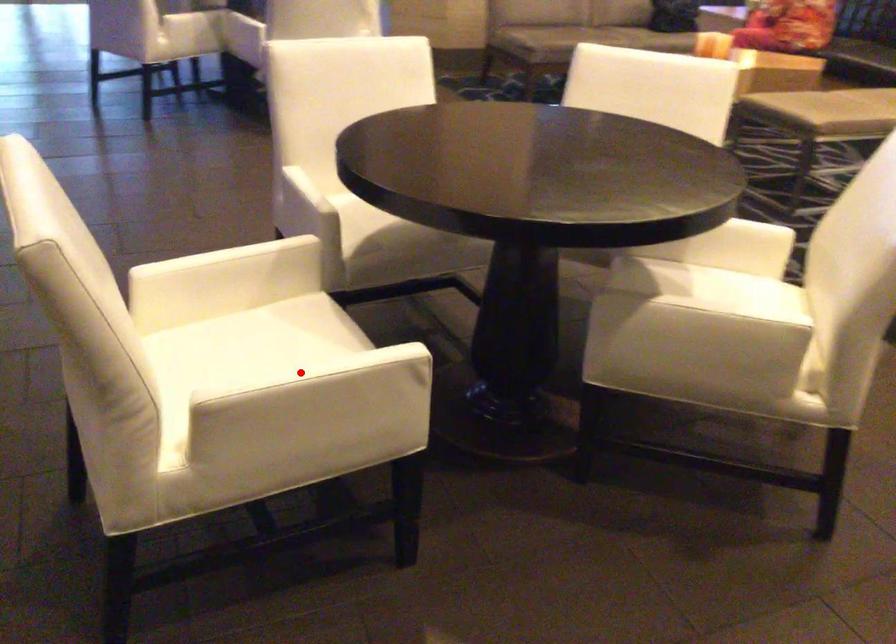
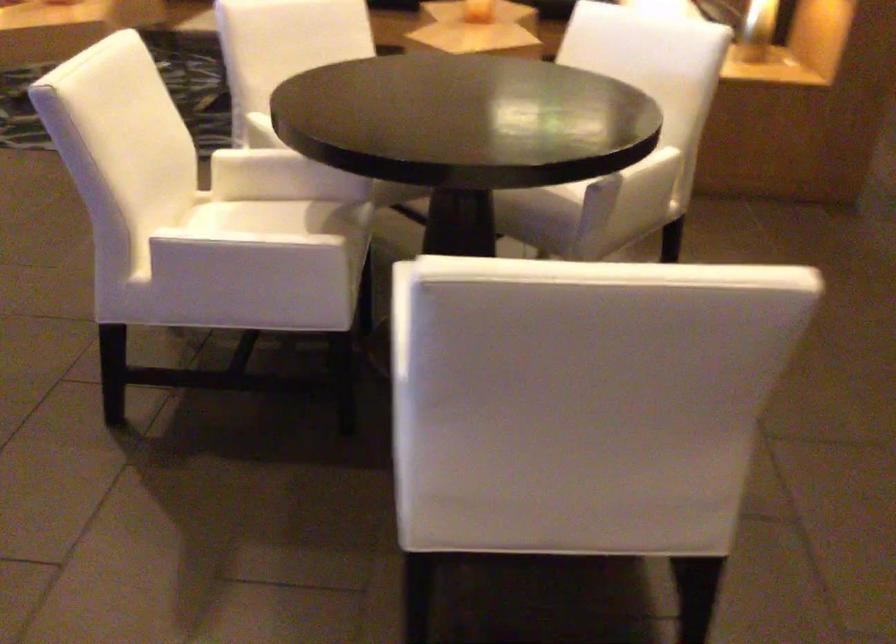
Question: I am providing you with two images of the same scene from different viewpoints. A red point is marked on the first image. Can you still see the location of the red point in image 2?

Choices:
 (A) Yes
 (B) No

Answer: (B)